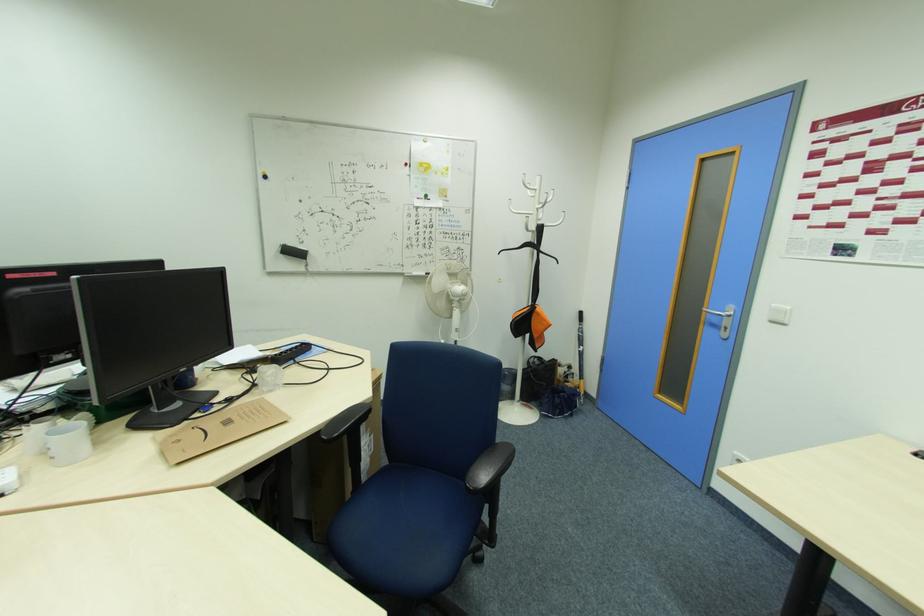
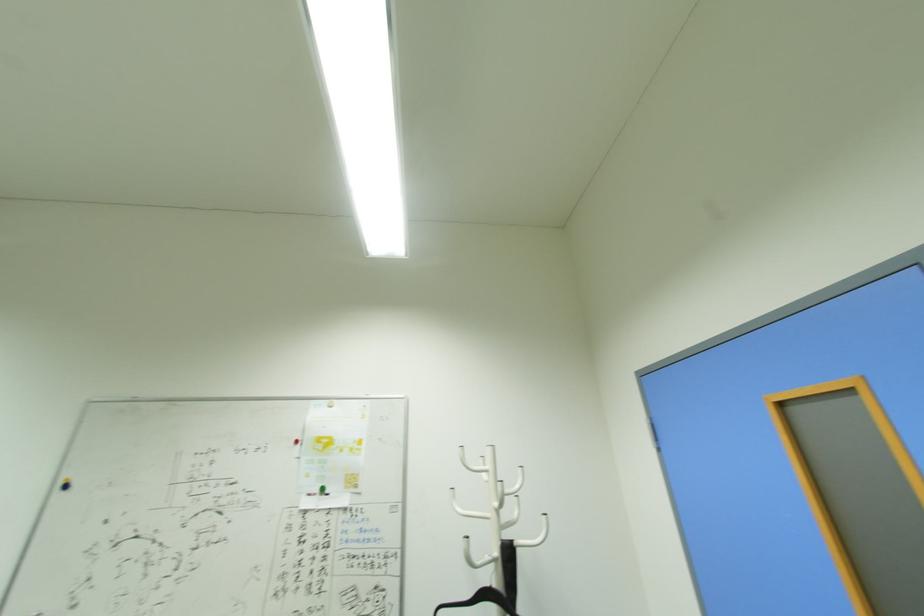
Locate, in the second image, the point that corresponds to point 533,230 in the first image.

(481, 564)